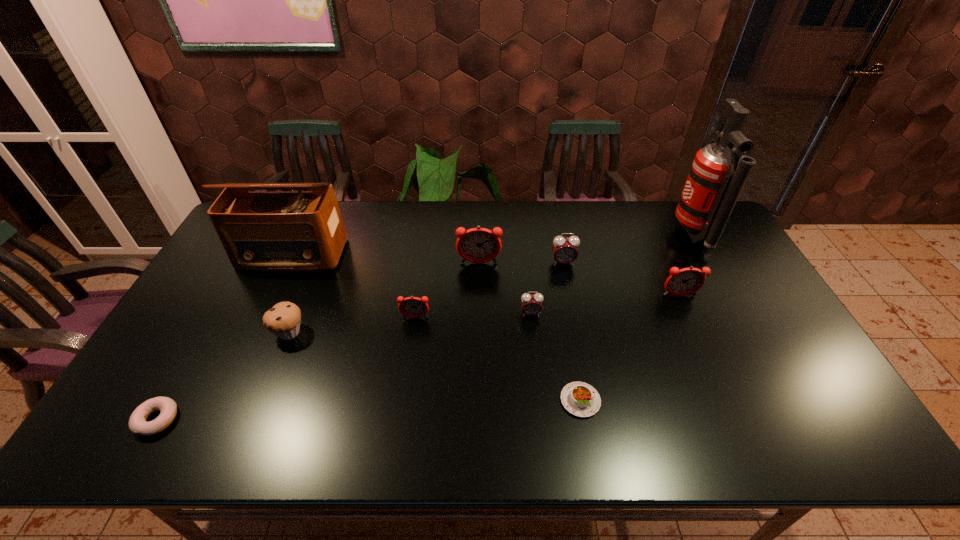
Where is `red fire extinguisher`? Image resolution: width=960 pixels, height=540 pixels. red fire extinguisher is located at coordinates (718, 174).

At what (x,y) coordinates should I click in order to perform the action: click on the tallest object. Please return your answer as a coordinate pair (x, y). Image resolution: width=960 pixels, height=540 pixels. Looking at the image, I should click on (718, 174).

This screenshot has height=540, width=960. Find the location of `the ninth shortest object`. the ninth shortest object is located at coordinates (290, 231).

The height and width of the screenshot is (540, 960). Find the location of `the tallest alarm clock`. the tallest alarm clock is located at coordinates (477, 245).

Where is `the second alarm clock from left to right`? the second alarm clock from left to right is located at coordinates (477, 245).

Image resolution: width=960 pixels, height=540 pixels. I want to click on the right pink alarm clock, so click(x=565, y=251).

In order to click on the bigger pink alarm clock in this screenshot , I will do 565,251.

Identify the location of the second nearest reddish-pink alarm clock. (686, 281).

Find the location of a particular element. The width and height of the screenshot is (960, 540). the sixth nearest object is located at coordinates (686, 281).

Locate an element on the screen. This screenshot has height=540, width=960. muffin is located at coordinates (283, 319).